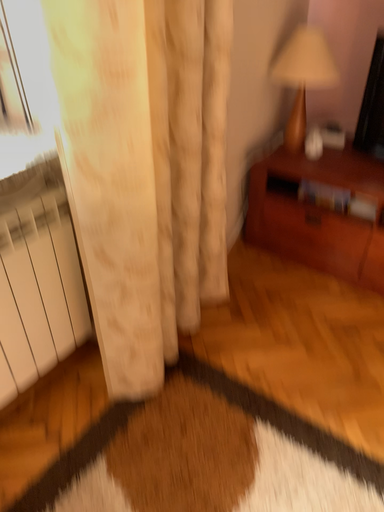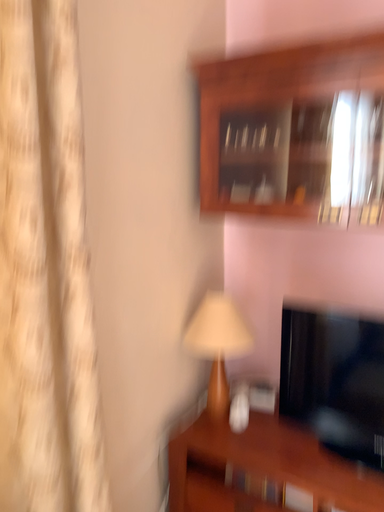
Question: How did the camera likely rotate when shooting the video?

Choices:
 (A) rotated downward
 (B) rotated upward

Answer: (B)